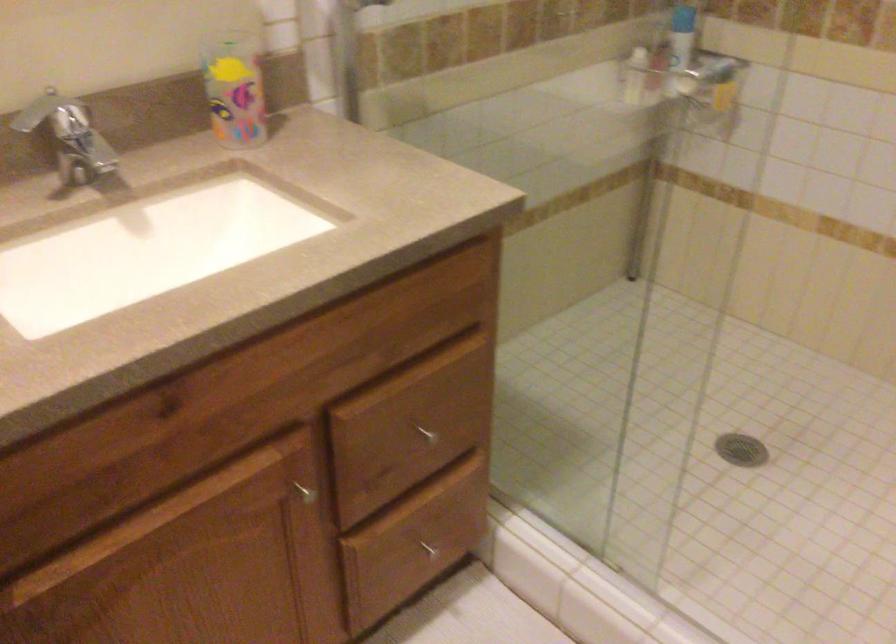
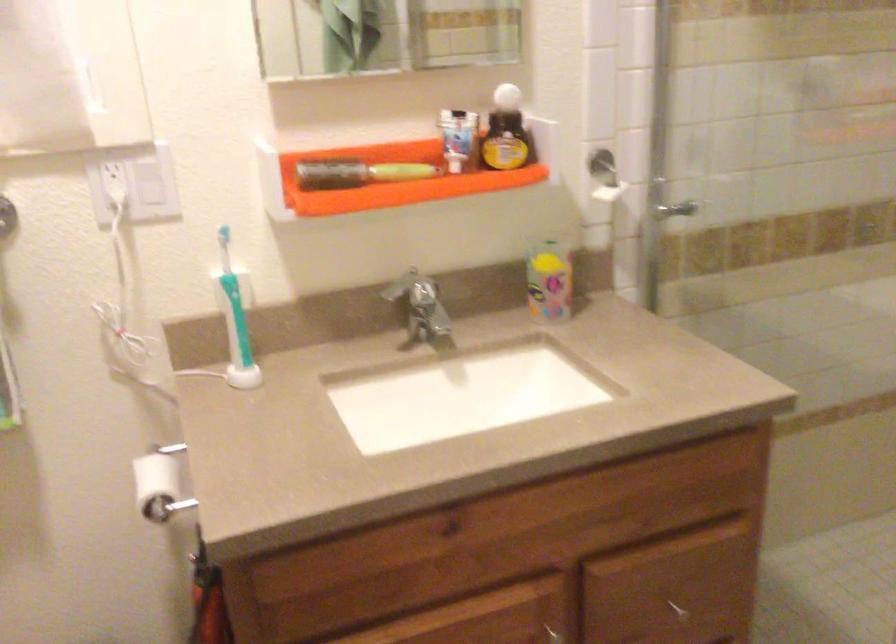
Locate, in the second image, the point that corresponds to [431,440] in the first image.

(677, 609)